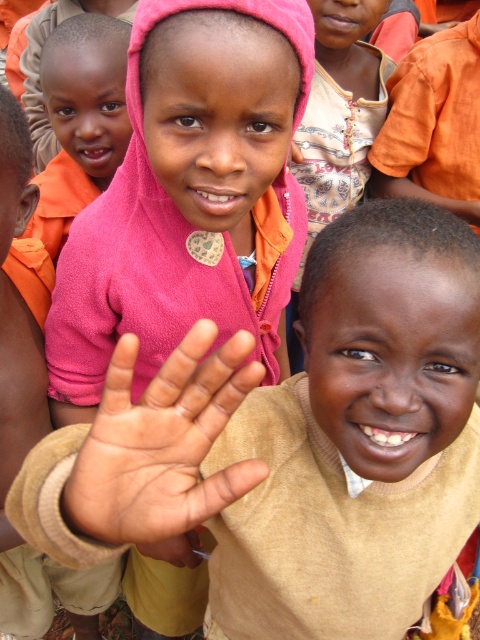
You are a photographer trying to capture a clear shot of the beige sweater at center and the pink fabric hand at center. Based on their positions, which object is closer to the camera?

The beige sweater at center is closer to the camera because the pink fabric hand at center is behind it.

You are a photographer trying to capture a closeup of the beige sweater at center. Based on the coordinates provided, where should you position your camera relative to the other children in the image?

The beige sweater at center is located at point coordinates, so you should position your camera directly facing the center of the image to capture it closely without obstruction from other children.